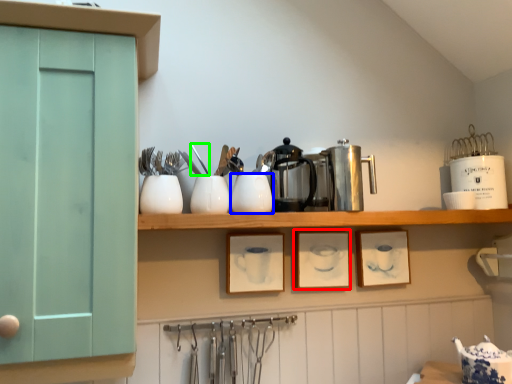
Question: Which object is the closest to the picture frame (highlighted by a red box)? Choose among these: tableware (highlighted by a blue box) or tableware (highlighted by a green box).

Choices:
 (A) tableware
 (B) tableware

Answer: (A)